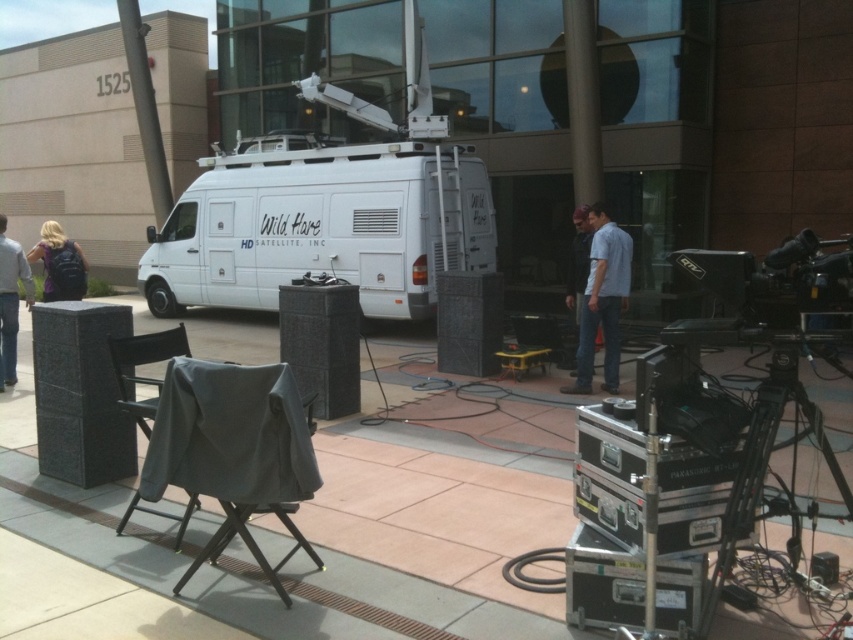
You are a technician setting up for a live broadcast. You need to place a gray fabric chair at lower left so that it is positioned to the left of the van. Is the current position at point (143, 364) suitable?

The gray fabric chair at lower left is already positioned to the left of the van at point (143, 364), so the current position is suitable.